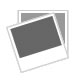
I want to click on white frame of a polaroid, so click(x=36, y=57), click(x=66, y=40).